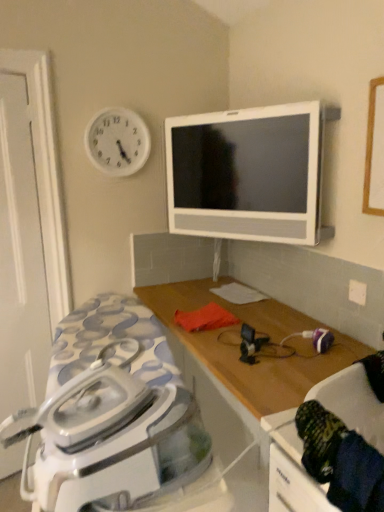
Image resolution: width=384 pixels, height=512 pixels. What are the coordinates of `vacant region below white glossy television at upper center (from a real-world perspective)` in the screenshot? It's located at (250, 302).